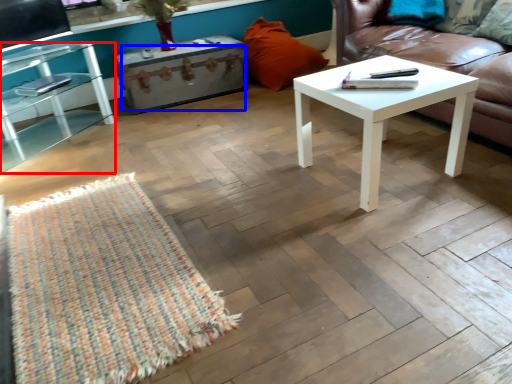
Question: Which of the following is the closest to the observer, table (highlighted by a red box) or drawer (highlighted by a blue box)?

Choices:
 (A) table
 (B) drawer

Answer: (A)